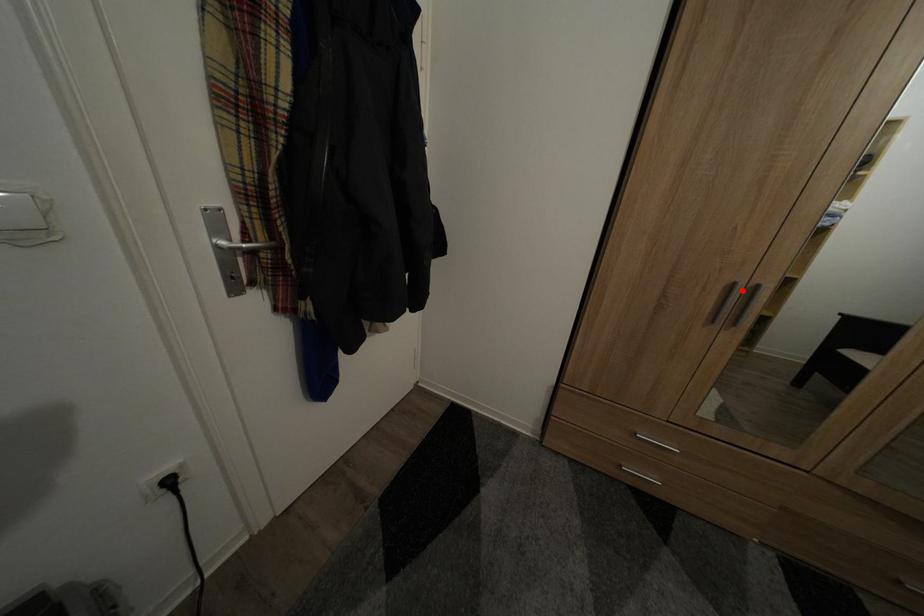
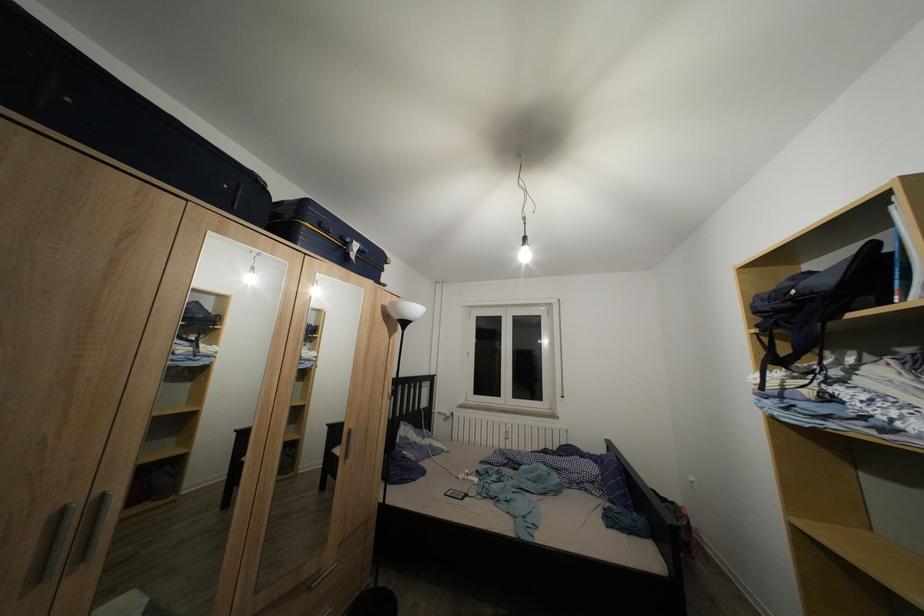
The point at the highlighted location is marked in the first image. Where is the corresponding point in the second image?

(71, 515)